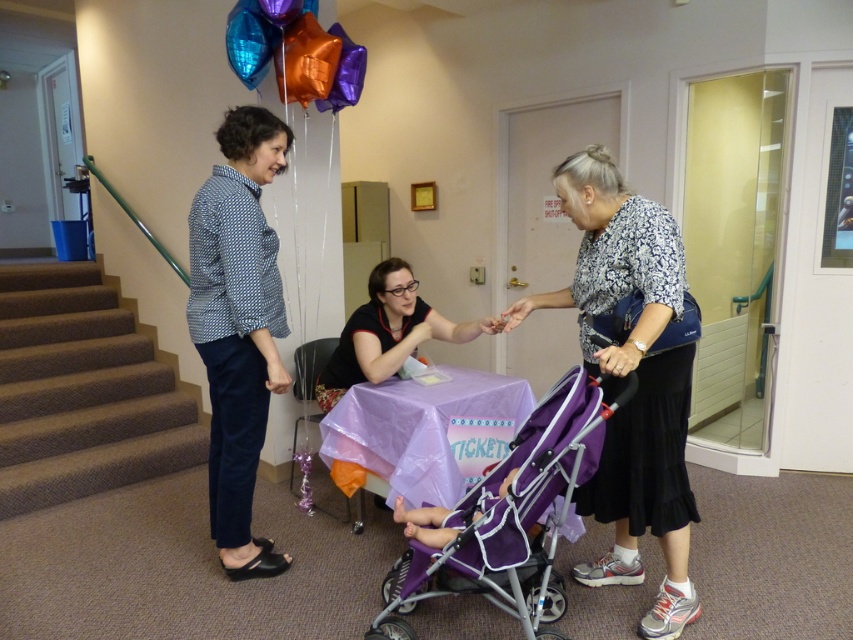
Question: Which of the following is the closest to the observer?

Choices:
 (A) (144, 460)
 (B) (389, 280)

Answer: (B)

Question: Estimate the real-world distances between objects in this image. Which object is closer to the purple glossy balloon at upper center?

Choices:
 (A) purple fabric table at center
 (B) blue dotted shirt at center
 (C) purple fabric stroller at center
 (D) shiny metallic balloon at upper center

Answer: (D)

Question: Which of the following is the farthest from the observer?

Choices:
 (A) (492, 324)
 (B) (212, 388)
 (C) (664, 280)
 (D) (312, 45)

Answer: (D)

Question: Can you confirm if purple fabric stroller at center is positioned below orange metallic balloon at upper center?

Choices:
 (A) yes
 (B) no

Answer: (A)

Question: Is matte floral blouse at center thinner than purple glossy balloon at upper center?

Choices:
 (A) no
 (B) yes

Answer: (A)

Question: Is the position of purple fabric table at center less distant than that of matte floral blouse at center?

Choices:
 (A) no
 (B) yes

Answer: (B)